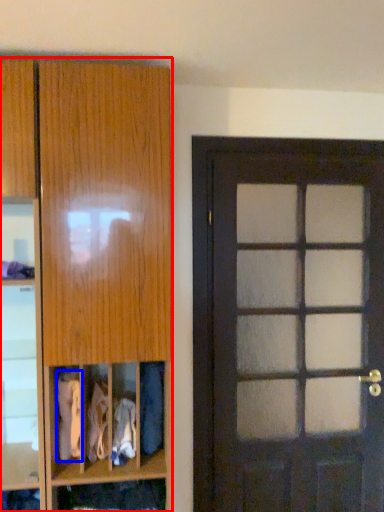
Question: Which object is further to the camera taking this photo, cabinetry (highlighted by a red box) or clothing (highlighted by a blue box)?

Choices:
 (A) cabinetry
 (B) clothing

Answer: (B)